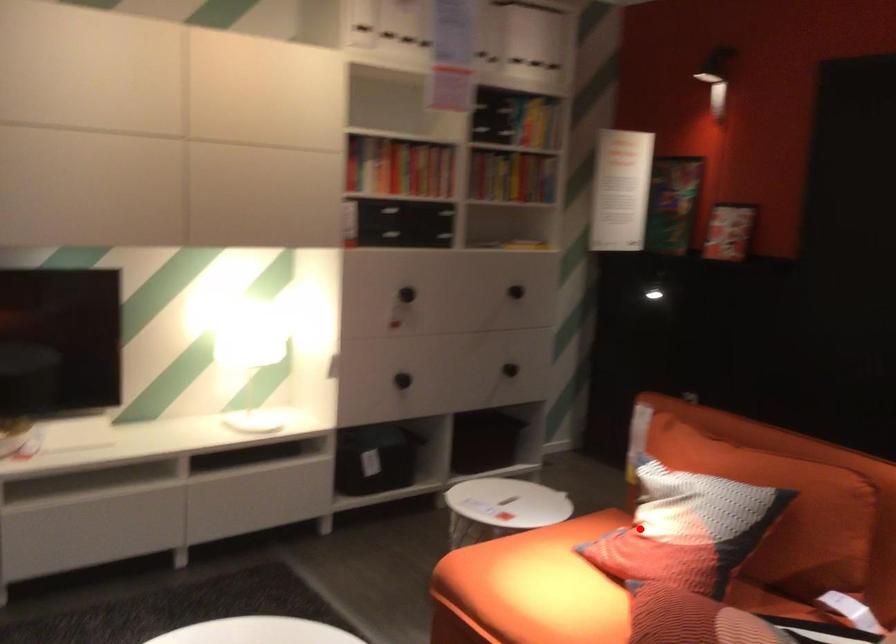
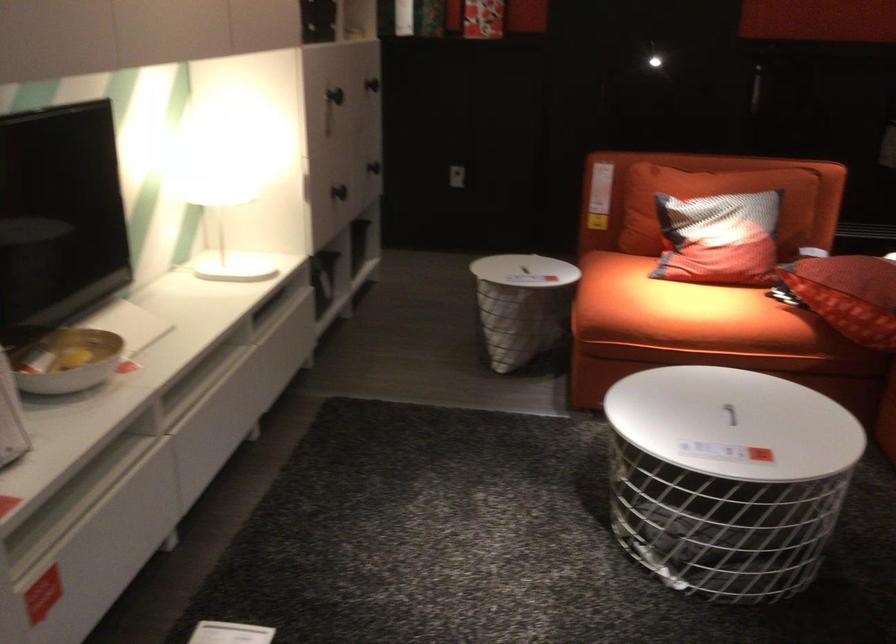
In the second image, find the point that corresponds to the highlighted location in the first image.

(719, 239)